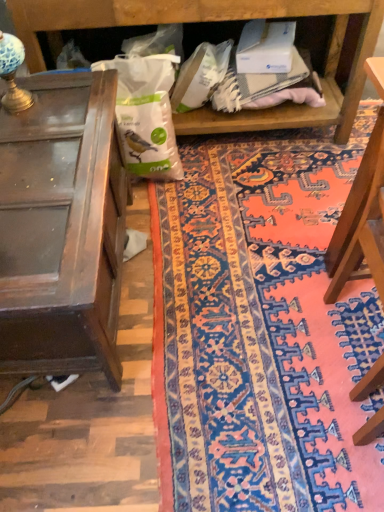
Identify the location of blank space situated above patterned carpet at center (from a real-world perspective). (244, 233).